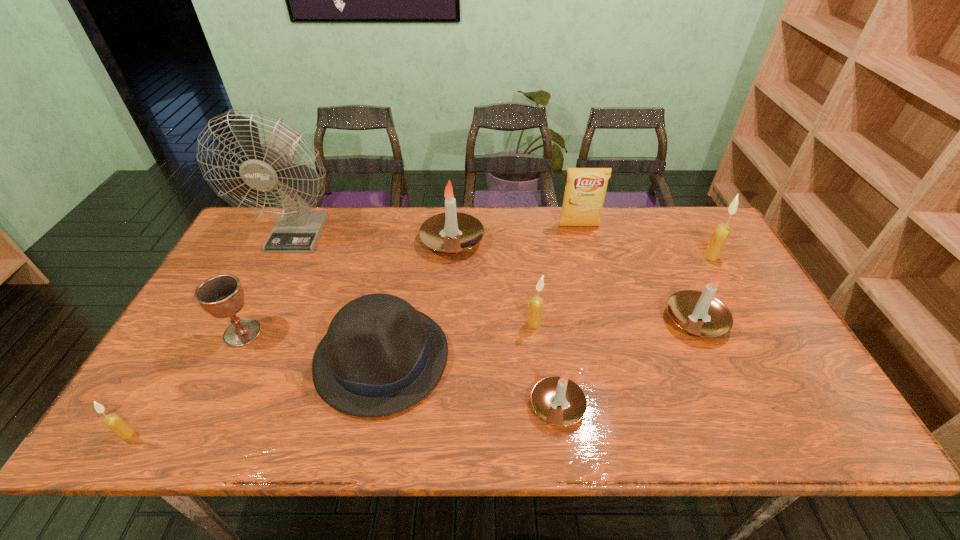
Find the location of a particular element. The width and height of the screenshot is (960, 540). vacant point located between the chalice and the crisp (potato chip) is located at coordinates (411, 280).

Locate an element on the screen. The image size is (960, 540). free point between the leftmost white candle and the leftmost cream candle is located at coordinates (290, 338).

This screenshot has height=540, width=960. Find the location of `unoccupied area between the rightmost cream candle and the brown chalice`. unoccupied area between the rightmost cream candle and the brown chalice is located at coordinates (477, 295).

This screenshot has height=540, width=960. I want to click on free space between the leftmost candle and the fan, so click(x=213, y=333).

Where is `free point between the farthest white candle and the second cream candle from left to right`? This screenshot has width=960, height=540. free point between the farthest white candle and the second cream candle from left to right is located at coordinates (493, 282).

The image size is (960, 540). In order to click on free space between the biggest white candle and the bowler hat in this screenshot , I will do `click(417, 300)`.

Locate an element on the screen. The height and width of the screenshot is (540, 960). free space between the biggest white candle and the leftmost cream candle is located at coordinates (290, 338).

Identify the location of vacant region between the smallest white candle and the rightmost object. (635, 331).

Select which object is the seventh closest to the second cream candle from left to right. Please provide its 2D coordinates. Your answer should be formatted as a tuple, i.e. [(x, y)], where the tuple contains the x and y coordinates of a point satisfying the conditions above.

[(297, 230)]

Locate which object ranks fourth in proximity to the second candle from left to right. Please provide its 2D coordinates. Your answer should be formatted as a tuple, i.e. [(x, y)], where the tuple contains the x and y coordinates of a point satisfying the conditions above.

[(536, 303)]